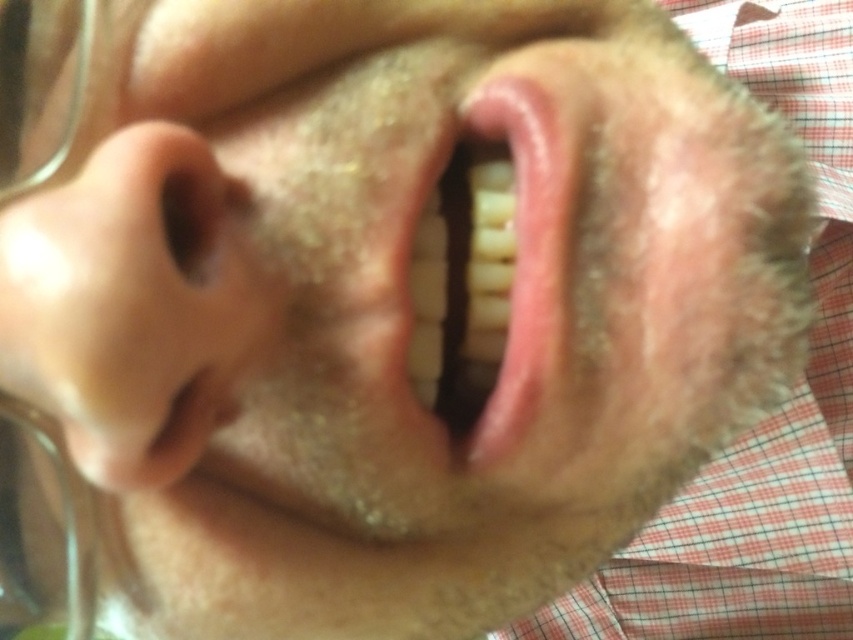
You are a dentist examining a patient and need to clean the smooth skin nose at left and the pink glossy lips at center. Which part should you clean first if you follow the standard procedure of starting with the closest object to the patient?

The smooth skin nose at left should be cleaned first because it is closer to the viewer than the pink glossy lips at center, aligning with the standard procedure of starting with the closest object to the patient.

You are a dentist examining a patient. You notice the smooth skin nose at left and the pink glossy lips at center. How far apart are these two features on the patient?

The smooth skin nose at left is 3.40 inches from the pink glossy lips at center.

You are a makeup artist applying lipstick to a client. You notice the smooth skin nose at left and the pink glossy lips at center. Which feature should you focus on first to ensure proper alignment of the lipstick application?

The smooth skin nose at left is positioned on the left side of the pink glossy lips at center, so you should focus on aligning the lipstick application starting from the pink glossy lips at center and ensuring symmetry relative to the smooth skin nose at left.